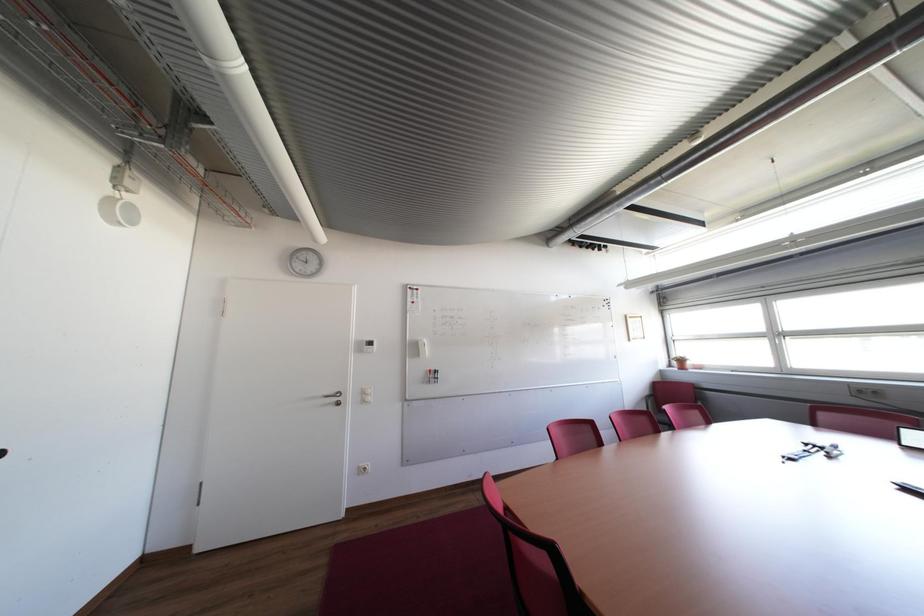
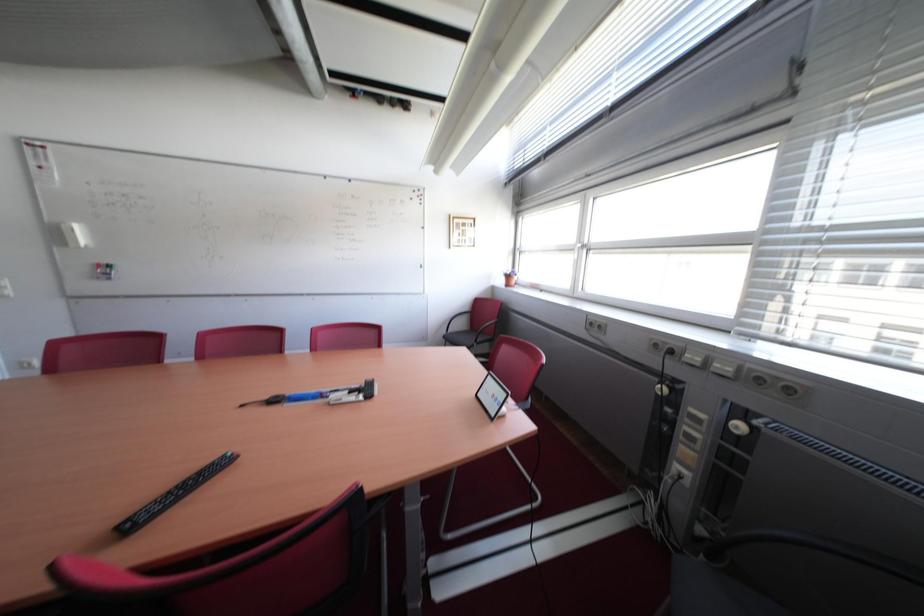
Question: What movement of the cameraman would produce the second image?

Choices:
 (A) Left
 (B) Right
 (C) Forward
 (D) Backward

Answer: (B)